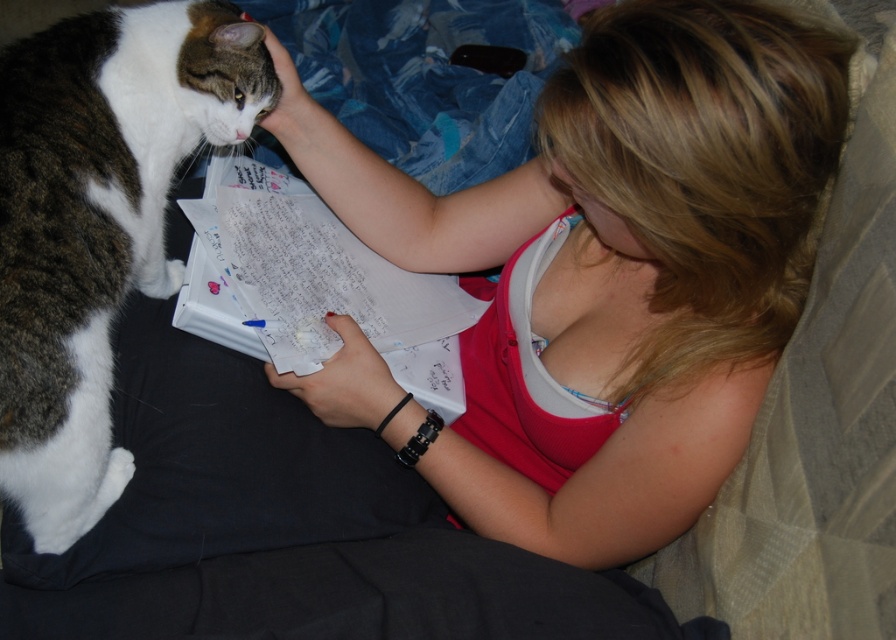
Is point (784, 128) positioned before point (218, 13)?

Yes, point (784, 128) is closer to viewer.

Can you confirm if matte pink tank top at center is taller than tabby fur cat at left?

Correct, matte pink tank top at center is much taller as tabby fur cat at left.

Is point (819, 70) less distant than point (139, 16)?

Yes, it is in front of point (139, 16).

You are a GUI agent. You are given a task and a screenshot of the screen. Output one action in this format:
    pyautogui.click(x=<x>, y=<y>)
    Task: Click on the matte pink tank top at center
    
    Given the screenshot: What is the action you would take?
    pyautogui.click(x=605, y=269)